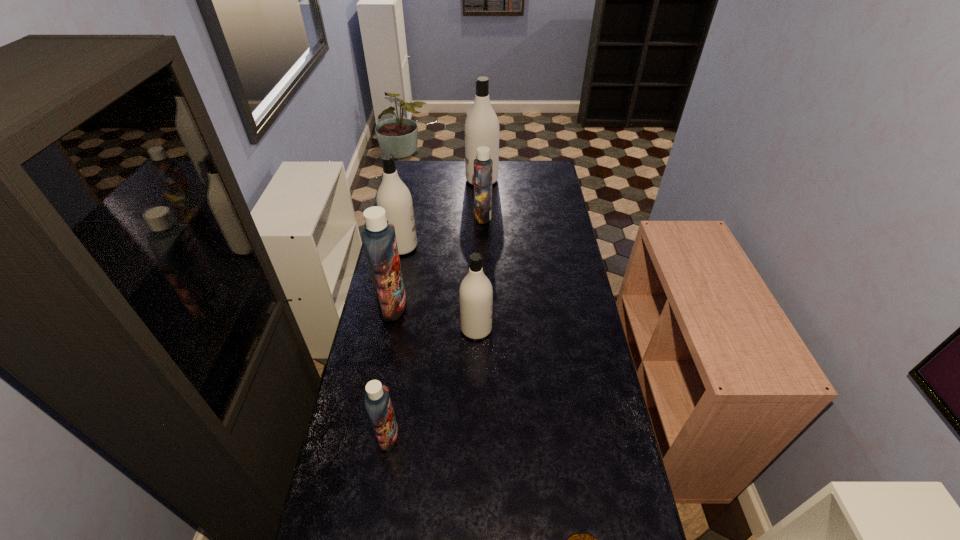
Where is `shampoo identified as the sixth closest to the rightmost object`? shampoo identified as the sixth closest to the rightmost object is located at coordinates (481, 128).

The height and width of the screenshot is (540, 960). In order to click on white shampoo that is the second closest one to the second biggest white shampoo in this screenshot , I will do `click(481, 128)`.

Select which white shampoo is the second closest to the second nearest object. Please provide its 2D coordinates. Your answer should be formatted as a tuple, i.e. [(x, y)], where the tuple contains the x and y coordinates of a point satisfying the conditions above.

[(393, 195)]

Identify the location of blue shampoo that stands as the second closest to the nearest white shampoo. [x=377, y=401].

Select which blue shampoo appears as the closest to the fourth nearest shampoo. Please provide its 2D coordinates. Your answer should be formatted as a tuple, i.e. [(x, y)], where the tuple contains the x and y coordinates of a point satisfying the conditions above.

[(379, 239)]